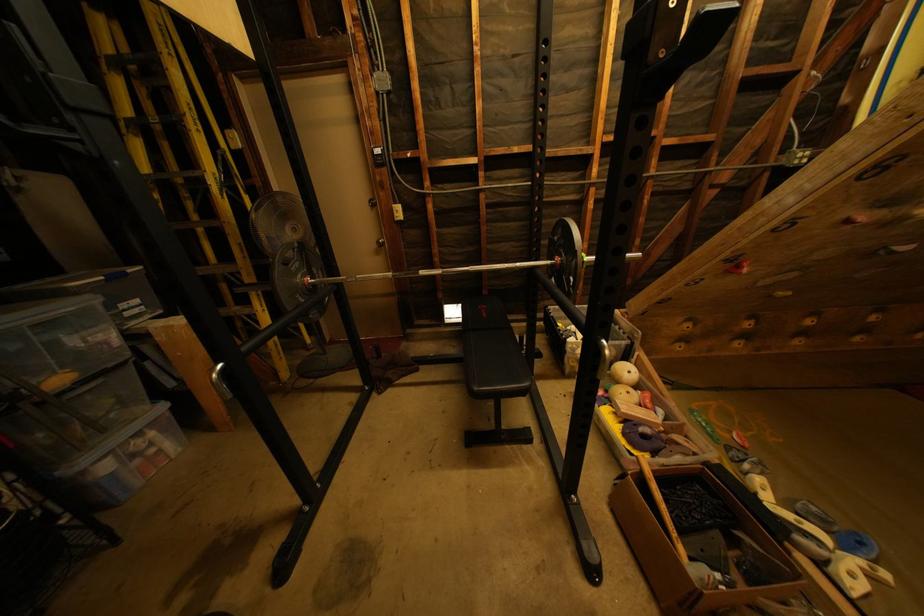
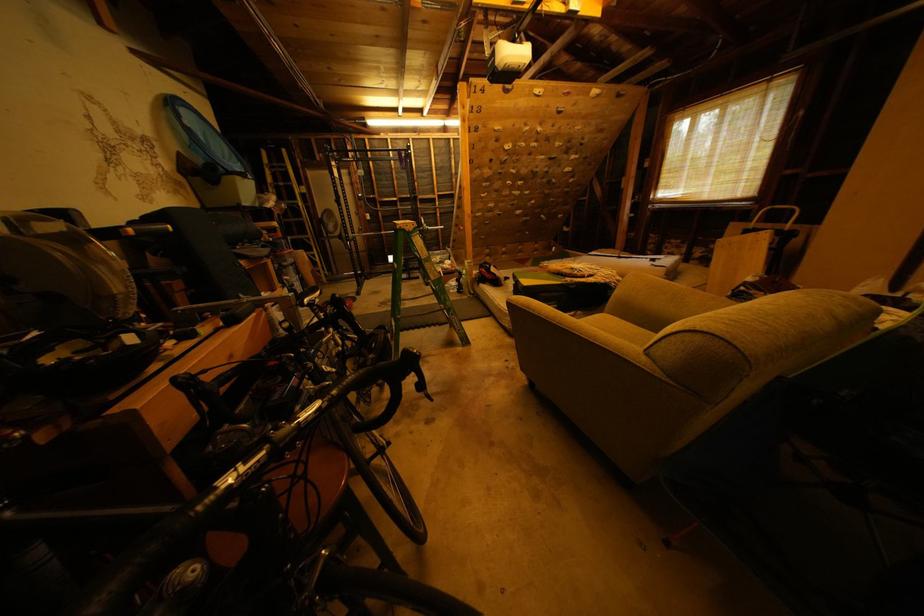
Question: The images are taken continuously from a first-person perspective. In which direction are you moving?

Choices:
 (A) Left
 (B) Right
 (C) Forward
 (D) Backward

Answer: (D)